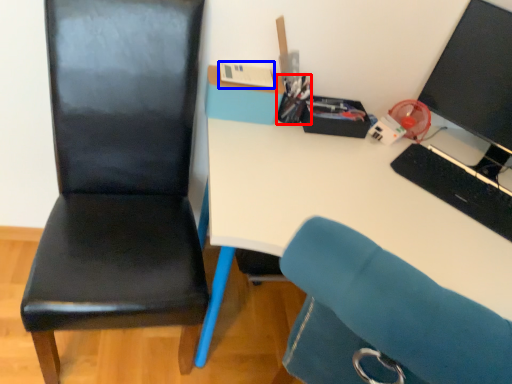
Question: Which object is closer to the camera taking this photo, stationery (highlighted by a red box) or stationery (highlighted by a blue box)?

Choices:
 (A) stationery
 (B) stationery

Answer: (B)